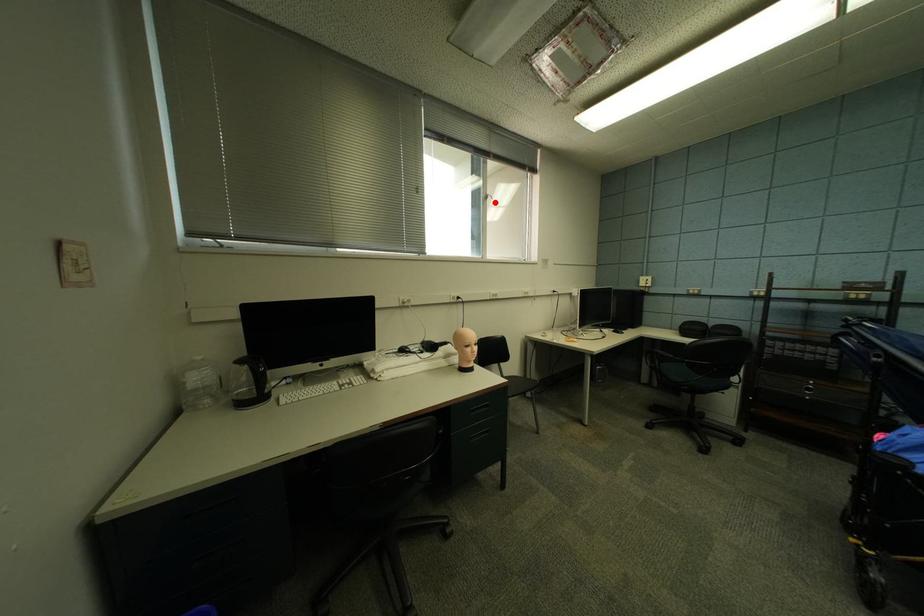
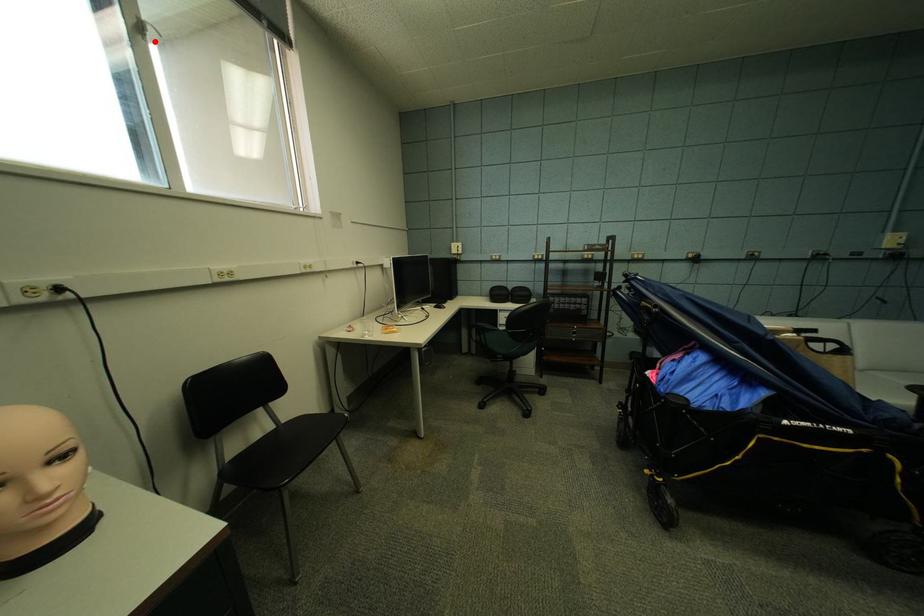
I am providing you with two images of the same scene from different viewpoints. A red point is marked on the first image and another point is marked on the second image. Do the highlighted points in image1 and image2 indicate the same real-world spot?

Yes